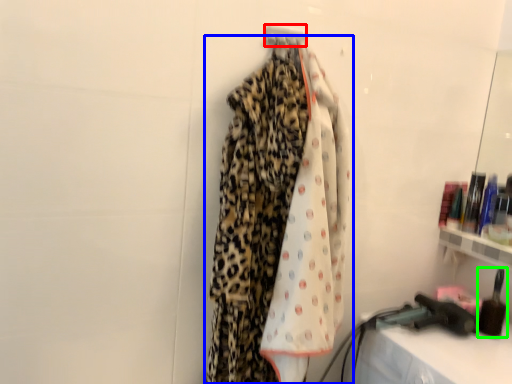
Question: Which object is the farthest from hanger (highlighted by a red box)? Choose among these: curtain (highlighted by a blue box) or toiletry (highlighted by a green box).

Choices:
 (A) curtain
 (B) toiletry

Answer: (B)